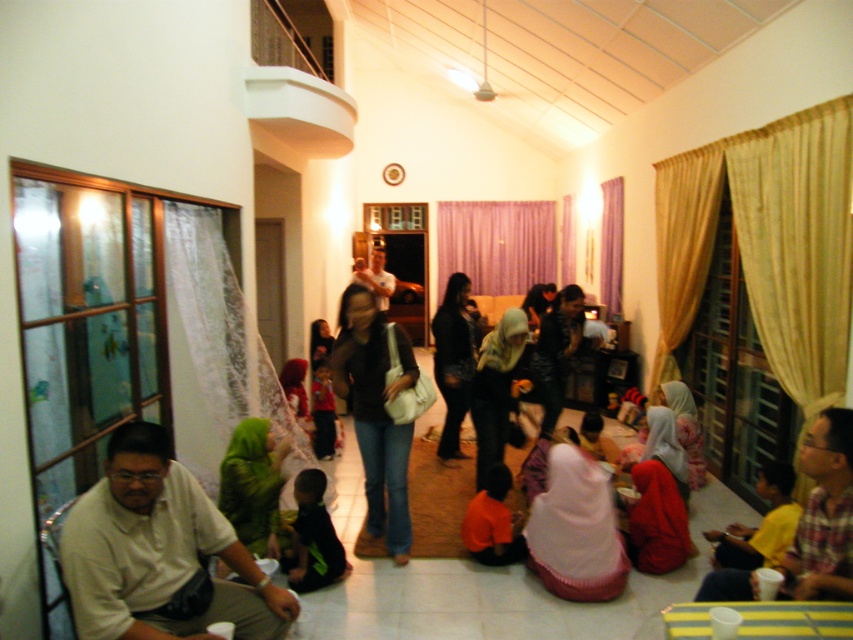
Question: Observing the image, what is the correct spatial positioning of matte black hijab at center in reference to shiny black jacket at center?

Choices:
 (A) right
 (B) left

Answer: (B)

Question: From the image, what is the correct spatial relationship of light brown shirt at lower left in relation to pink fabric headscarf at lower center?

Choices:
 (A) left
 (B) right

Answer: (A)

Question: Estimate the real-world distances between objects in this image. Which object is closer to the pink fabric headscarf at lower center?

Choices:
 (A) shiny black jacket at center
 (B) yellow plaid shirt at lower right

Answer: (B)

Question: Does matte black shirt at center have a larger size compared to orange fabric shirt at lower center?

Choices:
 (A) no
 (B) yes

Answer: (B)

Question: Which point is farther to the camera?

Choices:
 (A) (247, 502)
 (B) (813, 488)

Answer: (A)

Question: Among these points, which one is farthest from the camera?

Choices:
 (A) (190, 563)
 (B) (247, 477)
 (C) (561, 307)
 (D) (393, 541)

Answer: (C)